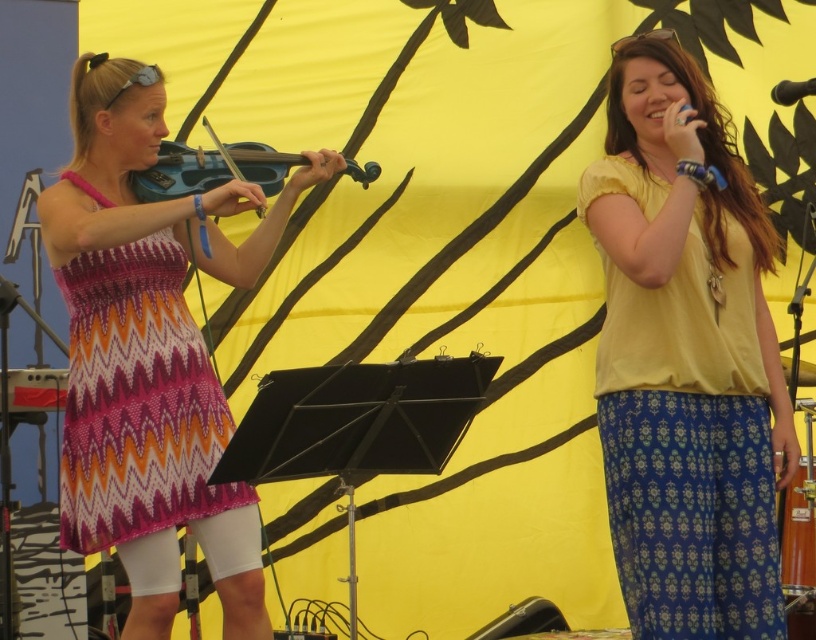
You are a photographer taking a picture of the stage. You notice two points marked in the scene. Which point, point [123,342] or point [295,154], is closer to your camera?

Point [123,342] is closer to the camera than point [295,154].

You are a stagehand setting up a new backdrop. You need to ensure that the matte purple dress at left and the black plastic microphone at upper right are visible from the audience seats. Given that the backdrop is 2 meters wide, can both objects be placed on the backdrop without overlapping?

The matte purple dress at left is wider than the black plastic microphone at upper right. Since the backdrop is 2 meters wide, both objects can be placed side by side as long as their combined widths do not exceed 2 meters. However, without knowing their exact widths, we cannot confirm if they will fit without overlapping.

In the scene, there are two performers on stage. The first performer is wearing a matte purple dress at left and playing a matte blue violin at left. From the perspective of someone watching the performance from the audience, which object is positioned further to the left?

The matte purple dress at left is positioned further to the left compared to the matte blue violin at left.